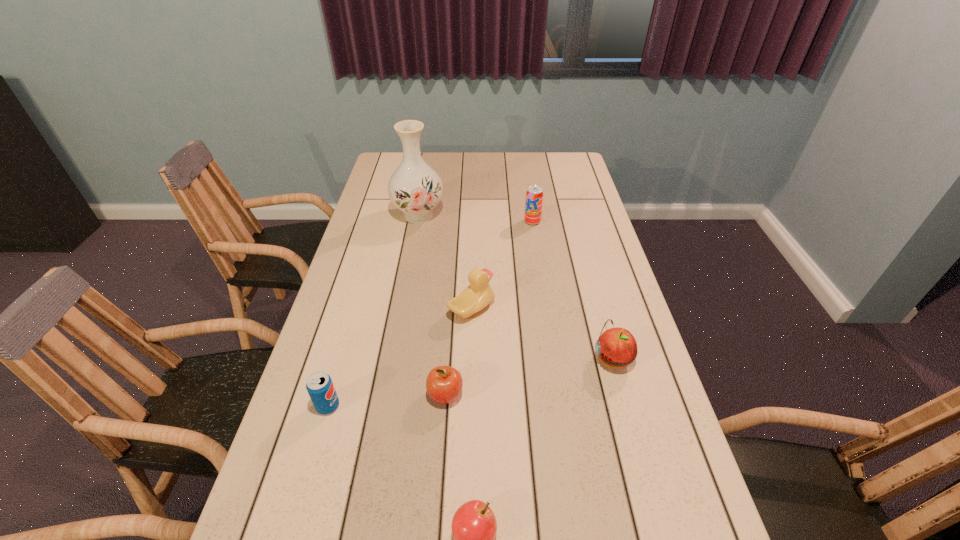
Locate an element on the screen. the sixth object from right to left is located at coordinates (415, 188).

Where is `vase`? vase is located at coordinates (415, 188).

Identify the location of the right soda can. The width and height of the screenshot is (960, 540). (534, 196).

You are a GUI agent. You are given a task and a screenshot of the screen. Output one action in this format:
    pyautogui.click(x=<x>, y=<y>)
    Task: Click on the farther soda can
    The image size is (960, 540).
    Given the screenshot: What is the action you would take?
    pyautogui.click(x=534, y=196)

Where is `duck`? The height and width of the screenshot is (540, 960). duck is located at coordinates (478, 294).

Find the location of a particular element. This screenshot has width=960, height=540. the rightmost object is located at coordinates (617, 347).

At what (x,y) coordinates should I click in order to perform the action: click on the rightmost apple. Please return your answer as a coordinate pair (x, y). Image resolution: width=960 pixels, height=540 pixels. Looking at the image, I should click on (617, 347).

I want to click on the second nearest apple, so click(x=444, y=384).

Where is `the shorter soda can`? Image resolution: width=960 pixels, height=540 pixels. the shorter soda can is located at coordinates (321, 390).

Locate an element on the screen. the nearer soda can is located at coordinates (321, 390).